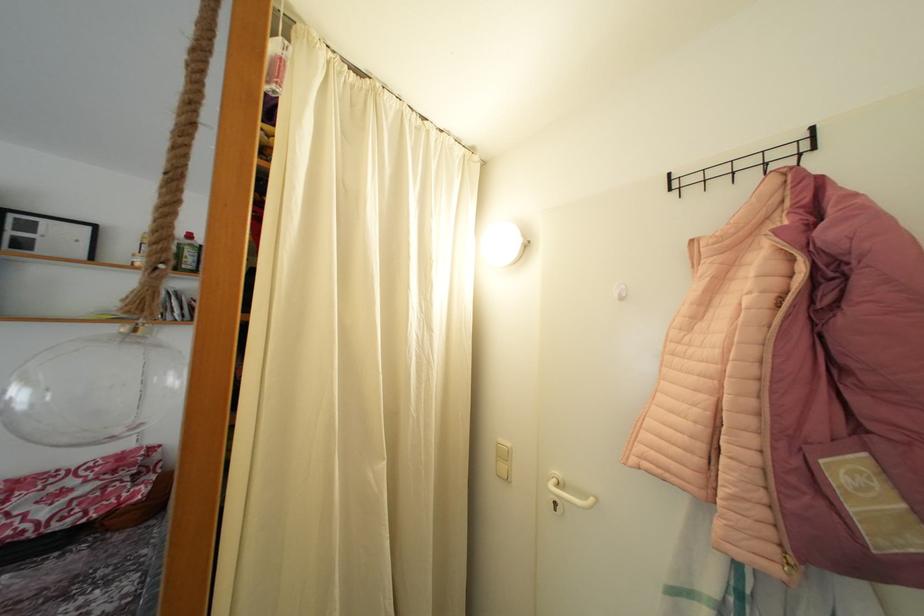
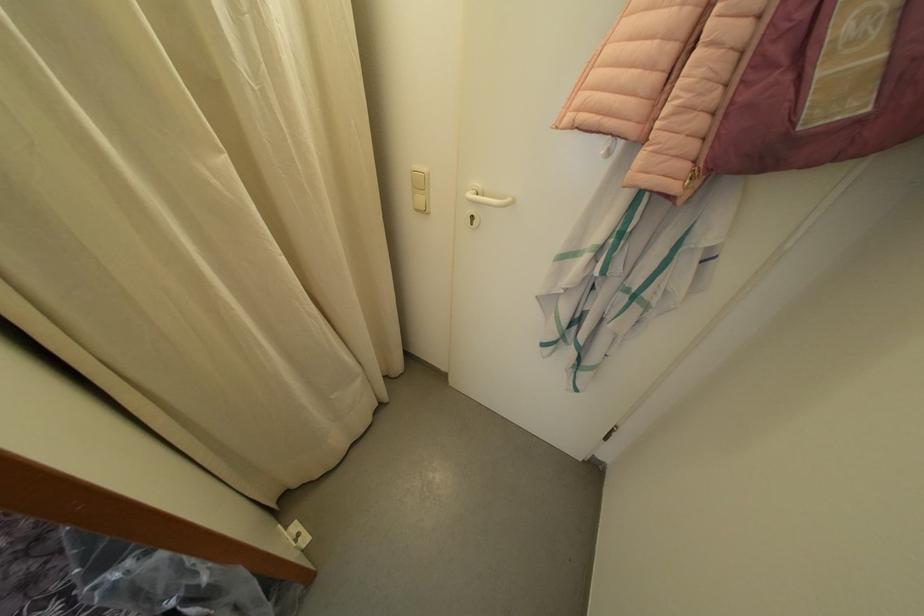
Locate, in the second image, the point that corresponds to point (563, 479) in the first image.

(482, 190)